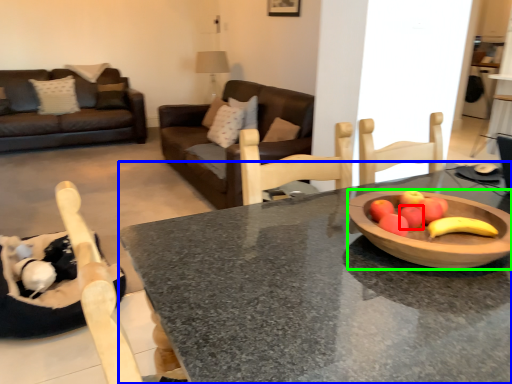
Question: Based on their relative distances, which object is farther from apple (highlighted by a red box)? Choose from desk (highlighted by a blue box) and bowl (highlighted by a green box).

Choices:
 (A) desk
 (B) bowl

Answer: (A)